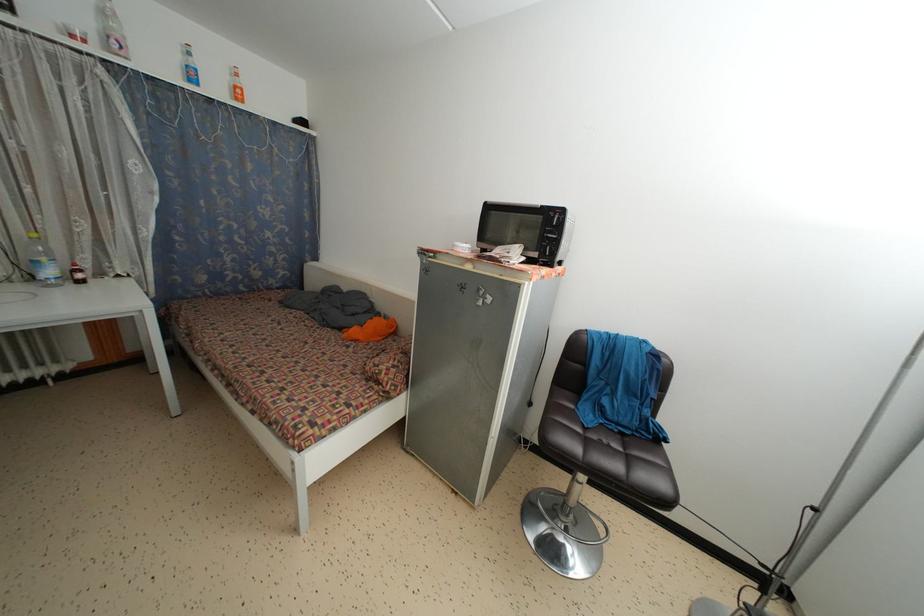
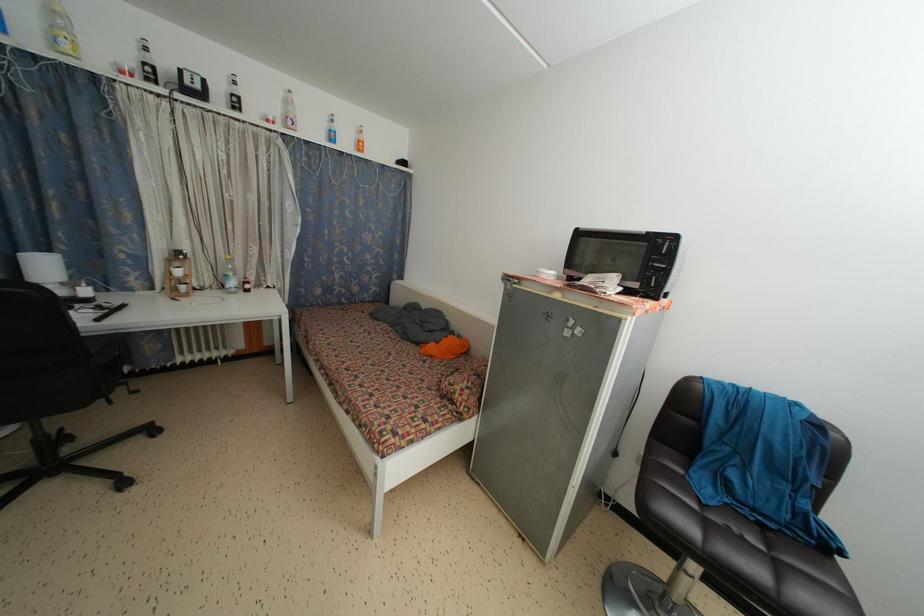
Where in the second image is the point corresponding to the point at 239,92 from the first image?

(362, 147)